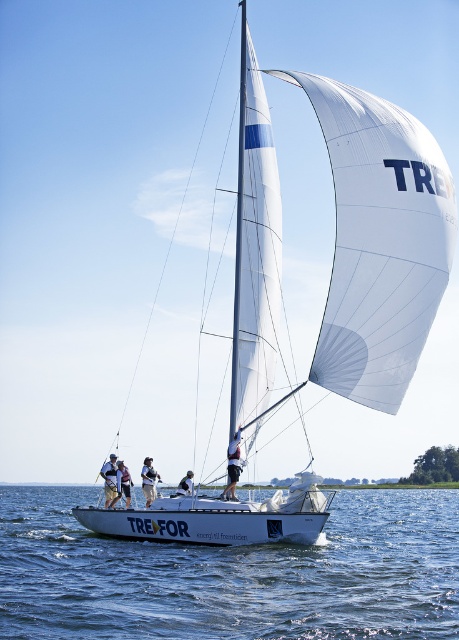
Question: Is white sail at center bigger than light brown fabric pants at center?

Choices:
 (A) yes
 (B) no

Answer: (A)

Question: Which point appears closest to the camera in this image?

Choices:
 (A) (101, 474)
 (B) (257, 355)

Answer: (B)

Question: Observing the image, what is the correct spatial positioning of white fabric shorts at center in reference to white fabric shirt at center?

Choices:
 (A) below
 (B) above

Answer: (B)

Question: Can you confirm if white sail at center is smaller than white fabric shorts at center?

Choices:
 (A) yes
 (B) no

Answer: (B)

Question: Considering the real-world distances, which object is farthest from the white fabric shirt at center?

Choices:
 (A) light brown fabric pants at center
 (B) white fabric life vest at center

Answer: (A)

Question: Among these objects, which one is farthest from the camera?

Choices:
 (A) white fabric life vest at center
 (B) clear blue water at center
 (C) white fabric sail at center
 (D) white fabric shirt at center

Answer: (A)